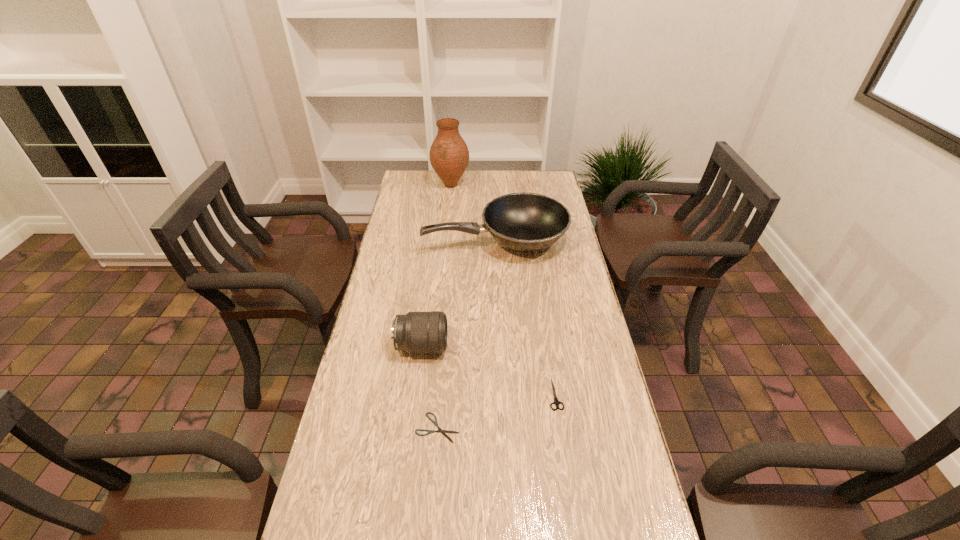
This screenshot has height=540, width=960. Find the location of `the farthest object`. the farthest object is located at coordinates (449, 156).

Identify the location of vase. (449, 156).

Identify the location of frying pan. (526, 222).

Identify the location of the third farthest object. Image resolution: width=960 pixels, height=540 pixels. (416, 332).

Image resolution: width=960 pixels, height=540 pixels. Identify the location of the taller shears. (556, 401).

Identify the location of the farther shears. Image resolution: width=960 pixels, height=540 pixels. (556, 401).

This screenshot has width=960, height=540. I want to click on the shorter shears, so click(443, 432).

Locate an element on the screen. the nearer shears is located at coordinates (443, 432).

You are a GUI agent. You are given a task and a screenshot of the screen. Output one action in this format:
    pyautogui.click(x=<x>, y=<y>)
    Task: Click on the free spot located on the front of the vase
    
    Given the screenshot: What is the action you would take?
    pyautogui.click(x=449, y=202)

Locate an element on the screen. The image size is (960, 540). free space located 0.070m on the back of the frying pan is located at coordinates (494, 208).